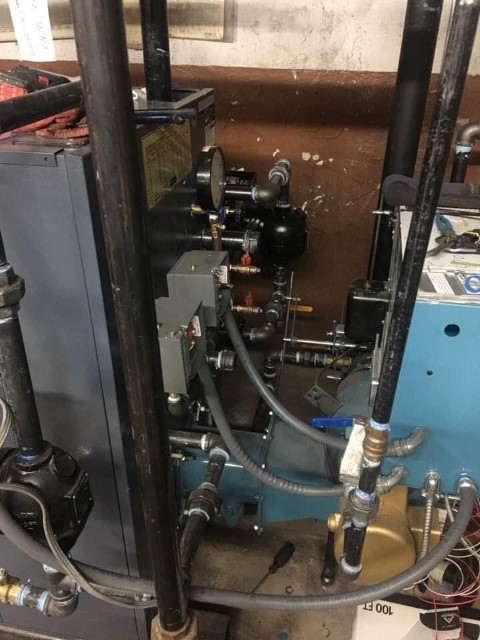
Locate an element on the screen. white wall is located at coordinates (276, 44), (276, 468).